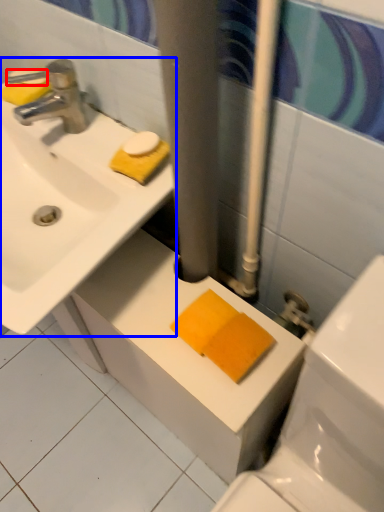
Question: Which point is closer to the camera, soap (highlighted by a red box) or sink (highlighted by a blue box)?

Choices:
 (A) soap
 (B) sink

Answer: (B)